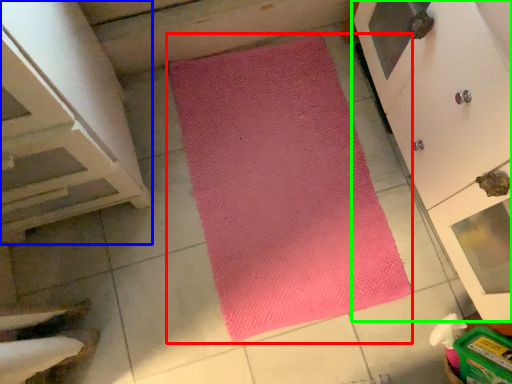
Question: Based on their relative distances, which object is nearer to mat (highlighted by a red box)? Choose from cabinetry (highlighted by a blue box) and cupboard (highlighted by a green box).

Choices:
 (A) cabinetry
 (B) cupboard

Answer: (B)